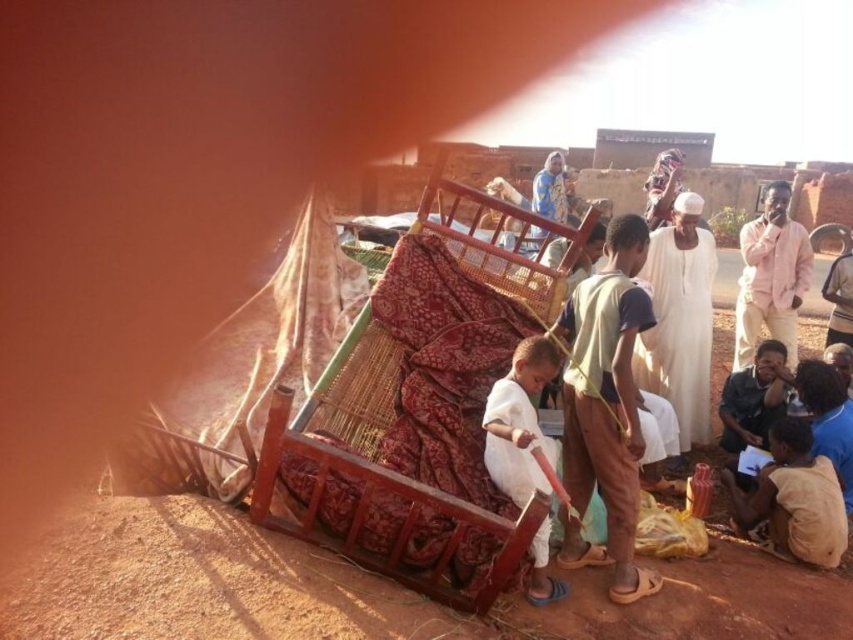
Question: Can you confirm if light brown fabric at lower right is positioned above white cotton child at center?

Choices:
 (A) no
 (B) yes

Answer: (A)

Question: Is brown dirt field at lower center to the right of light brown fabric at lower right from the viewer's perspective?

Choices:
 (A) no
 (B) yes

Answer: (A)

Question: Which point is closer to the camera?

Choices:
 (A) pink cotton shirt at upper right
 (B) brown dirt field at lower center

Answer: (B)

Question: Which point is farther to the camera?

Choices:
 (A) white cotton child at center
 (B) brown dirt field at lower center
 (C) light brown fabric at lower right

Answer: (C)

Question: Which of the following is the farthest from the observer?

Choices:
 (A) (61, 545)
 (B) (772, 250)

Answer: (B)

Question: Can you confirm if brown dirt field at lower center is positioned below white cotton child at center?

Choices:
 (A) no
 (B) yes

Answer: (B)